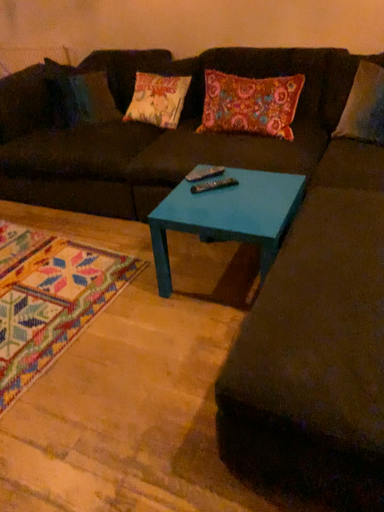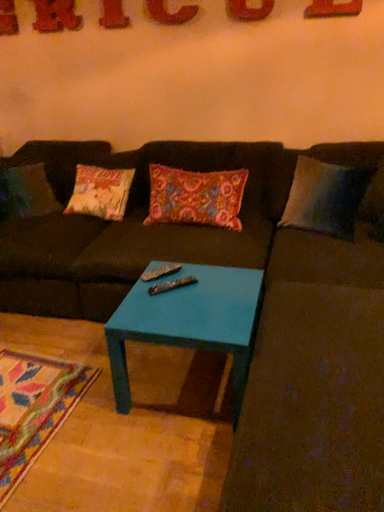
Question: How did the camera likely rotate when shooting the video?

Choices:
 (A) rotated left
 (B) rotated right

Answer: (B)